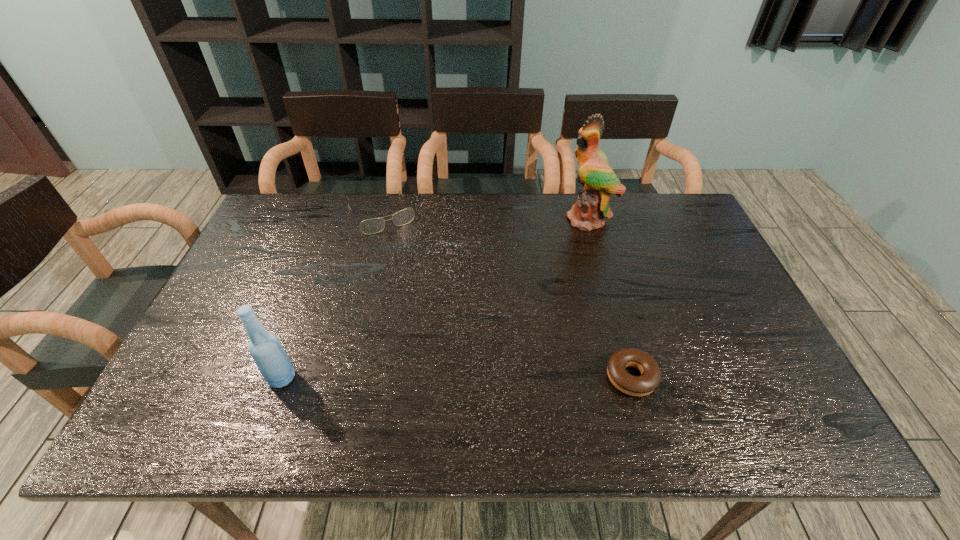
Identify the location of free region located on the front-facing side of the third tallest object. (407, 256).

What are the coordinates of `vacant area situated on the front-facing side of the third tallest object` in the screenshot? It's located at (430, 295).

Find the location of a particular element. This screenshot has height=540, width=960. parrot that is at the far edge is located at coordinates (598, 179).

Where is `spectacles that is at the far edge`? The width and height of the screenshot is (960, 540). spectacles that is at the far edge is located at coordinates (375, 225).

In order to click on bottle that is at the near edge in this screenshot , I will do [x=265, y=348].

I want to click on doughnut located at the near edge, so click(x=650, y=378).

You are a GUI agent. You are given a task and a screenshot of the screen. Output one action in this format:
    pyautogui.click(x=<x>, y=<y>)
    Task: Click on the vacant space at the far edge of the desktop
    The height and width of the screenshot is (540, 960).
    Given the screenshot: What is the action you would take?
    pyautogui.click(x=492, y=216)

Identify the location of vacant space at the near edge. (605, 394).

This screenshot has width=960, height=540. What are the coordinates of `free space at the left edge of the desktop` in the screenshot? It's located at coord(268,260).

Find the location of a particular element. This screenshot has width=960, height=540. blank space at the right edge of the desktop is located at coordinates point(717,281).